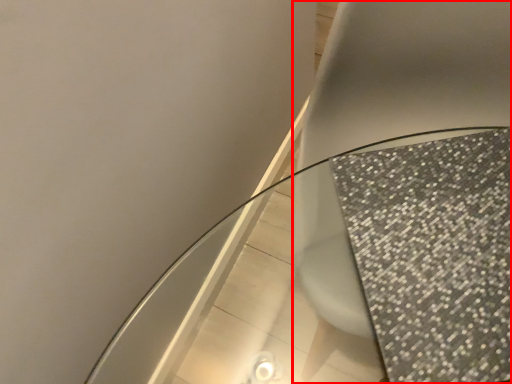
Question: From the image's perspective, what is the correct spatial relationship of toilet (annotated by the red box) in relation to round table?

Choices:
 (A) above
 (B) below

Answer: (A)